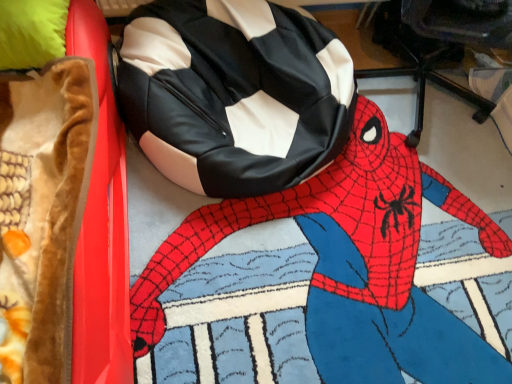
Question: Should I look upward or downward to see black leather bean bag chair at center?

Choices:
 (A) down
 (B) up

Answer: (B)

Question: From the image's perspective, is black leather bean bag chair at center beneath velvet brown blanket at left?

Choices:
 (A) yes
 (B) no

Answer: (B)

Question: Is black leather bean bag chair at center not close to velvet brown blanket at left?

Choices:
 (A) no
 (B) yes

Answer: (A)

Question: Does black leather bean bag chair at center come behind velvet brown blanket at left?

Choices:
 (A) yes
 (B) no

Answer: (A)

Question: Can you confirm if black leather bean bag chair at center is wider than velvet brown blanket at left?

Choices:
 (A) no
 (B) yes

Answer: (A)

Question: Is black leather bean bag chair at center taller than velvet brown blanket at left?

Choices:
 (A) yes
 (B) no

Answer: (B)

Question: From the image's perspective, is black leather bean bag chair at center over velvet brown blanket at left?

Choices:
 (A) yes
 (B) no

Answer: (A)

Question: Can you confirm if velvet brown blanket at left is bigger than black leather bean bag chair at center?

Choices:
 (A) no
 (B) yes

Answer: (B)

Question: Does velvet brown blanket at left appear on the left side of black leather bean bag chair at center?

Choices:
 (A) yes
 (B) no

Answer: (A)

Question: Is velvet brown blanket at left facing towards black leather bean bag chair at center?

Choices:
 (A) no
 (B) yes

Answer: (A)

Question: Is velvet brown blanket at left in front of black leather bean bag chair at center?

Choices:
 (A) yes
 (B) no

Answer: (A)

Question: Is velvet brown blanket at left not close to black leather bean bag chair at center?

Choices:
 (A) yes
 (B) no

Answer: (B)

Question: Can you confirm if velvet brown blanket at left is positioned to the right of black leather bean bag chair at center?

Choices:
 (A) yes
 (B) no

Answer: (B)

Question: From a real-world perspective, is black leather bean bag at upper center physically above black leather bean bag chair at center?

Choices:
 (A) no
 (B) yes

Answer: (A)